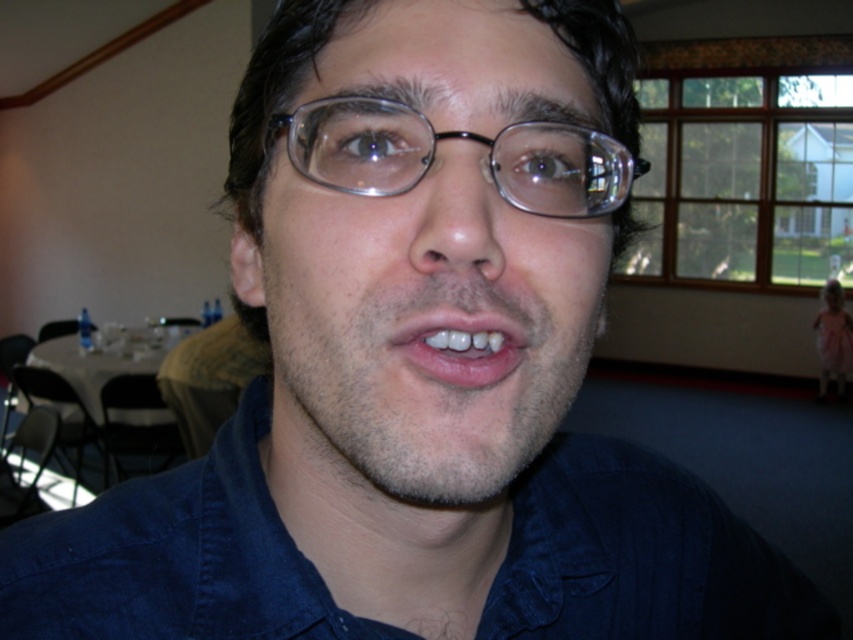
You are a photographer adjusting your camera settings to focus on the clear plastic glasses at center and the white glossy teeth at center. Which object is positioned to the left of the other?

The clear plastic glasses at center are to the left of the white glossy teeth at center.

You are a photographer adjusting the focus on your camera. You want to ensure both the clear plastic glasses at center and the staircase in the upper left corner are in focus. Given the depth of field, can you confirm if both will be sharp?

The clear plastic glasses at center and the staircase in the upper left corner are 11.17 inches apart. Depending on the camera settings, if the depth of field is sufficient to cover this distance, both could be in focus. However, without specific aperture information, it is uncertain. Adjust the aperture to a smaller opening for a greater depth of field to increase the chances.